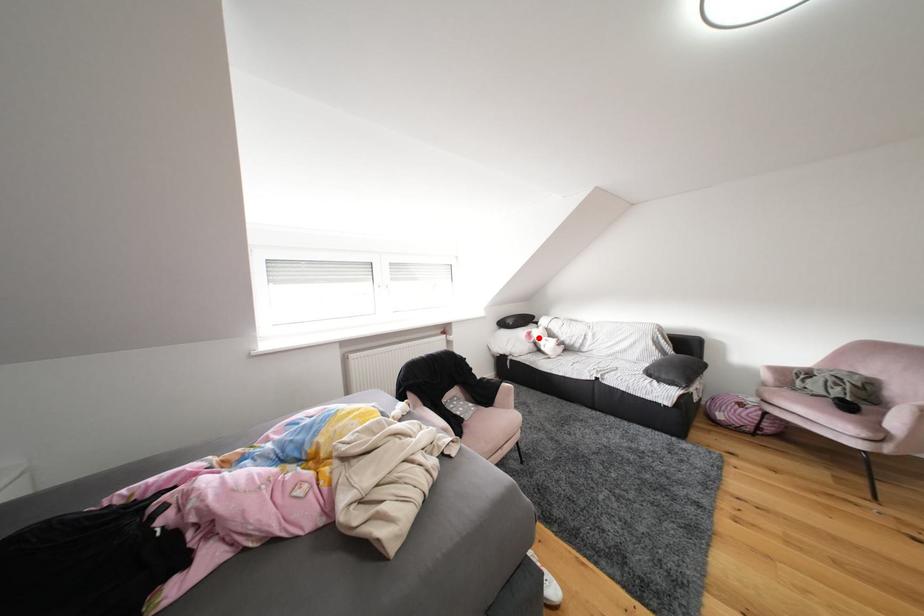
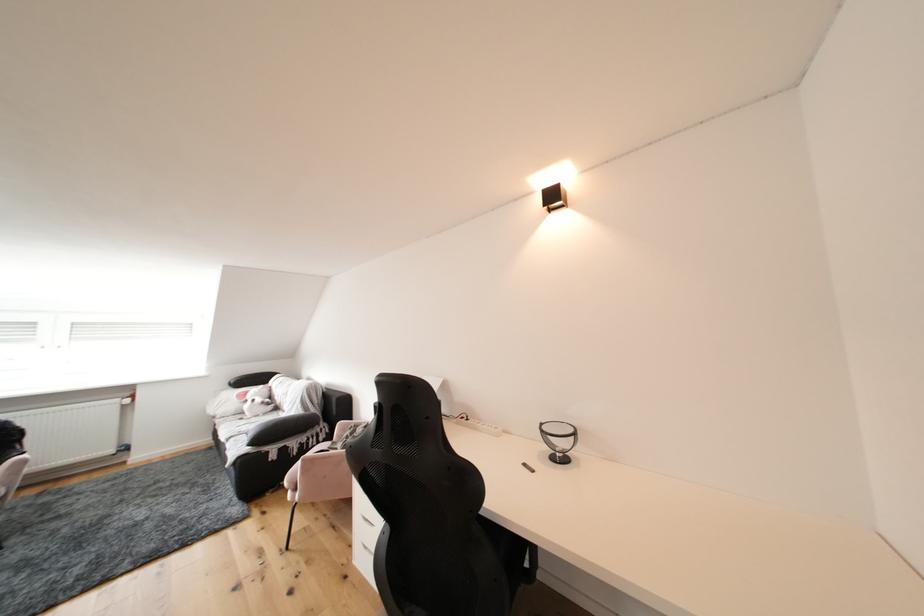
Question: A red point is marked in image1. In image2, is the corresponding 3D point closer to the camera or farther? Reply with the corresponding letter.

Choices:
 (A) The corresponding 3D point is closer.
 (B) The corresponding 3D point is farther.

Answer: (B)